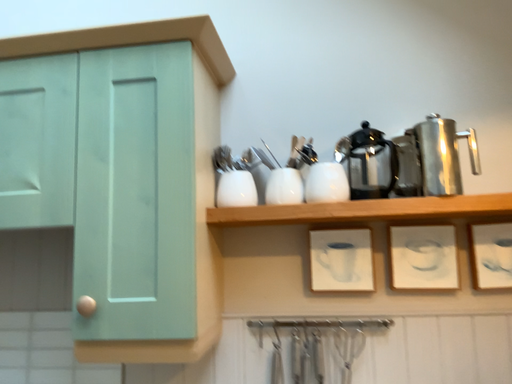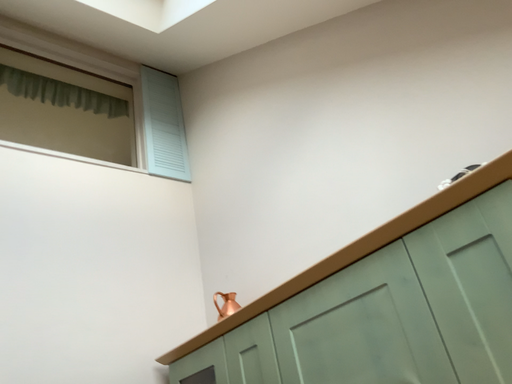
Question: How did the camera likely rotate when shooting the video?

Choices:
 (A) rotated left
 (B) rotated right

Answer: (A)